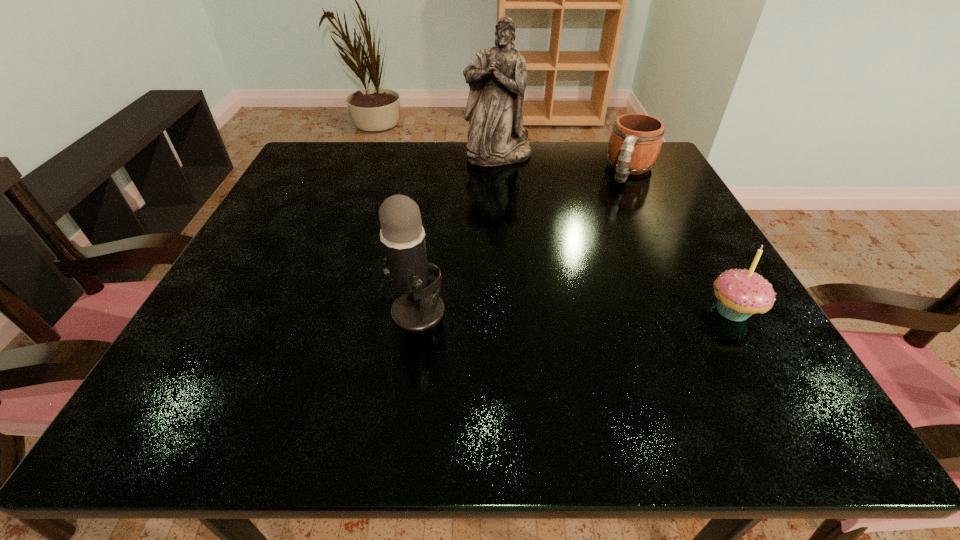
I want to click on vacant space located 0.130m on the front-facing side of the figurine, so 511,196.

Find the location of a particular element. free space located 0.190m on the side of the mug with the handle is located at coordinates (604, 234).

Locate an element on the screen. The height and width of the screenshot is (540, 960). free space located on the side of the mug with the handle is located at coordinates (602, 237).

Locate an element on the screen. This screenshot has height=540, width=960. vacant area situated on the side of the mug with the handle is located at coordinates (575, 291).

At what (x,y) coordinates should I click in order to perform the action: click on figurine positioned at the far edge. Please return your answer as a coordinate pair (x, y). Looking at the image, I should click on (497, 80).

Image resolution: width=960 pixels, height=540 pixels. What are the coordinates of `mug that is positioned at the far edge` in the screenshot? It's located at (636, 139).

Identify the location of microphone at the near edge. (402, 235).

This screenshot has width=960, height=540. Identify the location of cupcake located in the near edge section of the desktop. (740, 293).

Where is `cupcake present at the right edge`? This screenshot has height=540, width=960. cupcake present at the right edge is located at coordinates (740, 293).

Where is `mug located in the right edge section of the desktop`? The height and width of the screenshot is (540, 960). mug located in the right edge section of the desktop is located at coordinates (636, 139).